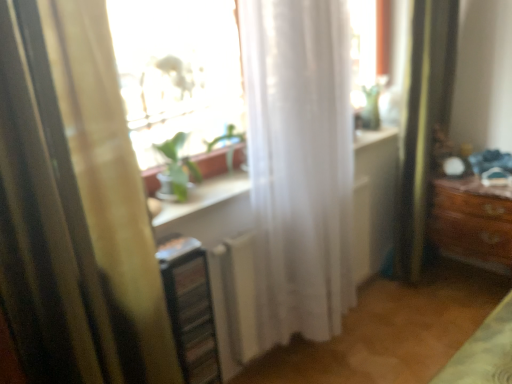
Question: From a real-world perspective, does metallic silver shelf at lower left sit lower than white sheer curtain at center, placed as the second curtain when sorted from left to right?

Choices:
 (A) no
 (B) yes

Answer: (B)

Question: From the image's perspective, is metallic silver shelf at lower left located beneath white sheer curtain at center, placed as the second curtain when sorted from left to right?

Choices:
 (A) no
 (B) yes

Answer: (B)

Question: Considering the relative sizes of metallic silver shelf at lower left and white sheer curtain at center, positioned as the 1th curtain in right-to-left order, in the image provided, is metallic silver shelf at lower left thinner than white sheer curtain at center, positioned as the 1th curtain in right-to-left order,?

Choices:
 (A) yes
 (B) no

Answer: (A)

Question: Does metallic silver shelf at lower left have a smaller size compared to white sheer curtain at center, positioned as the 1th curtain in right-to-left order?

Choices:
 (A) no
 (B) yes

Answer: (B)

Question: Is metallic silver shelf at lower left further to the viewer compared to white sheer curtain at center, positioned as the 1th curtain in right-to-left order?

Choices:
 (A) no
 (B) yes

Answer: (B)

Question: Can you confirm if metallic silver shelf at lower left is taller than white sheer curtain at center, placed as the second curtain when sorted from left to right?

Choices:
 (A) yes
 (B) no

Answer: (B)

Question: Does transparent glass window at center have a smaller size compared to yellow striped curtain at left, the 1th curtain positioned from the left?

Choices:
 (A) no
 (B) yes

Answer: (B)

Question: Is transparent glass window at center outside yellow striped curtain at left, the 1th curtain positioned from the left?

Choices:
 (A) no
 (B) yes

Answer: (B)

Question: Is transparent glass window at center facing away from yellow striped curtain at left, the 1th curtain positioned from the left?

Choices:
 (A) no
 (B) yes

Answer: (A)

Question: From a real-world perspective, is transparent glass window at center positioned over yellow striped curtain at left, the 1th curtain positioned from the left, based on gravity?

Choices:
 (A) yes
 (B) no

Answer: (A)

Question: From the image's perspective, is transparent glass window at center below yellow striped curtain at left, placed as the 2th curtain when sorted from right to left?

Choices:
 (A) no
 (B) yes

Answer: (A)

Question: Are transparent glass window at center and yellow striped curtain at left, placed as the 2th curtain when sorted from right to left, located far from each other?

Choices:
 (A) yes
 (B) no

Answer: (B)

Question: From the image's perspective, is white sheer curtain at center, positioned as the 1th curtain in right-to-left order, over green fabric shower curtain at right?

Choices:
 (A) no
 (B) yes

Answer: (A)